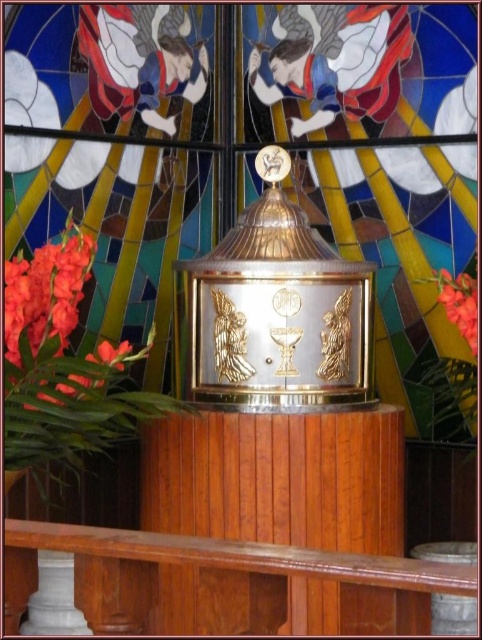
Question: Is stained glass window at center smaller than matte red flower at right?

Choices:
 (A) no
 (B) yes

Answer: (A)

Question: Which point is farther to the camera?

Choices:
 (A) (x=473, y=308)
 (B) (x=56, y=244)

Answer: (B)

Question: Does stained glass window at center have a greater width compared to matte red flower at right?

Choices:
 (A) yes
 (B) no

Answer: (A)

Question: In this image, where is matte orange flower at lower left located relative to matte red flower at right?

Choices:
 (A) above
 (B) below

Answer: (A)

Question: Which is nearer to the stained glass window at center?

Choices:
 (A) matte red flower at right
 (B) matte orange flower at lower left

Answer: (B)

Question: Which object is closer to the camera taking this photo?

Choices:
 (A) matte orange flower at lower left
 (B) matte red flower at right

Answer: (A)